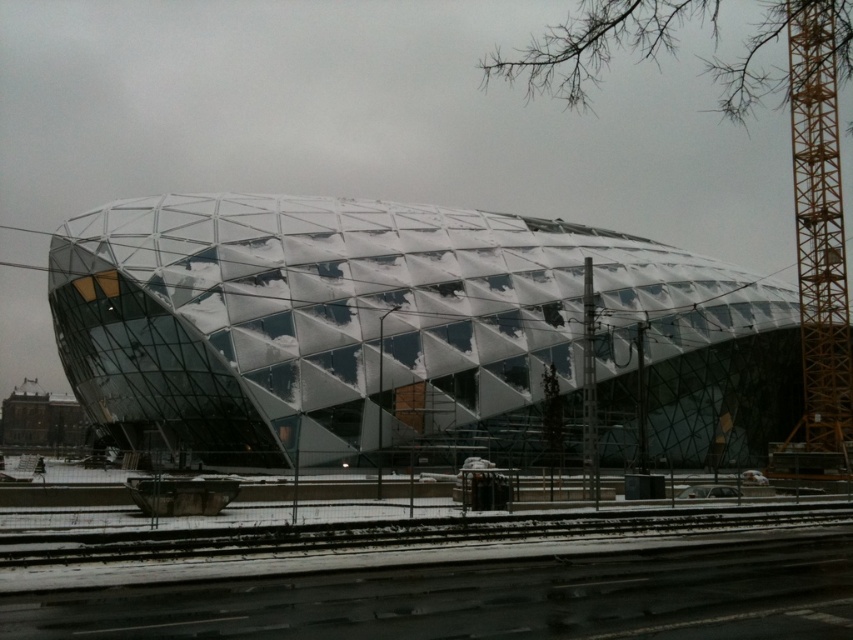
The height and width of the screenshot is (640, 853). Identify the location of metallic glass dome at center. (405, 332).

Can you confirm if metallic glass dome at center is wider than yellow metallic crane at right?

Yes.

Find the location of `metallic glass dome at center`. metallic glass dome at center is located at coordinates (405, 332).